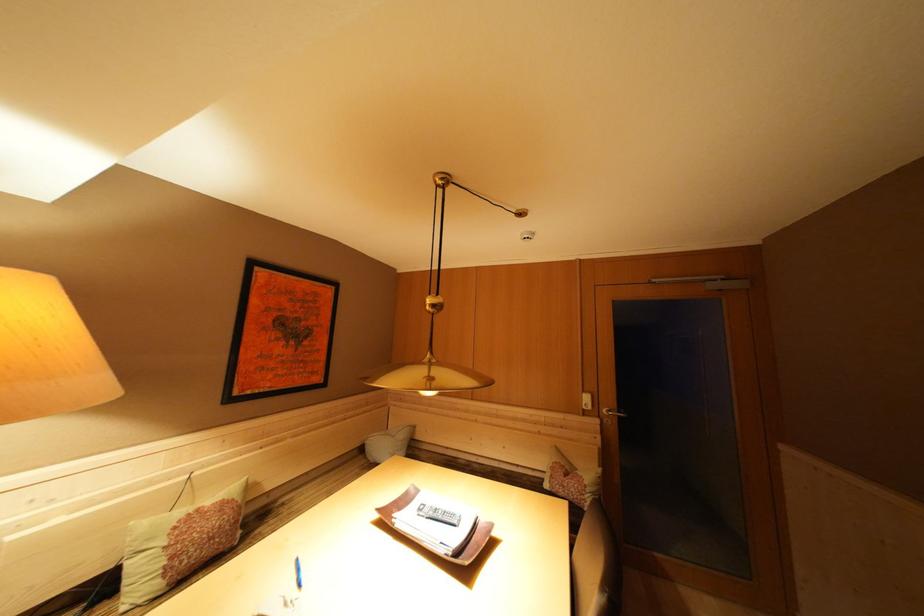
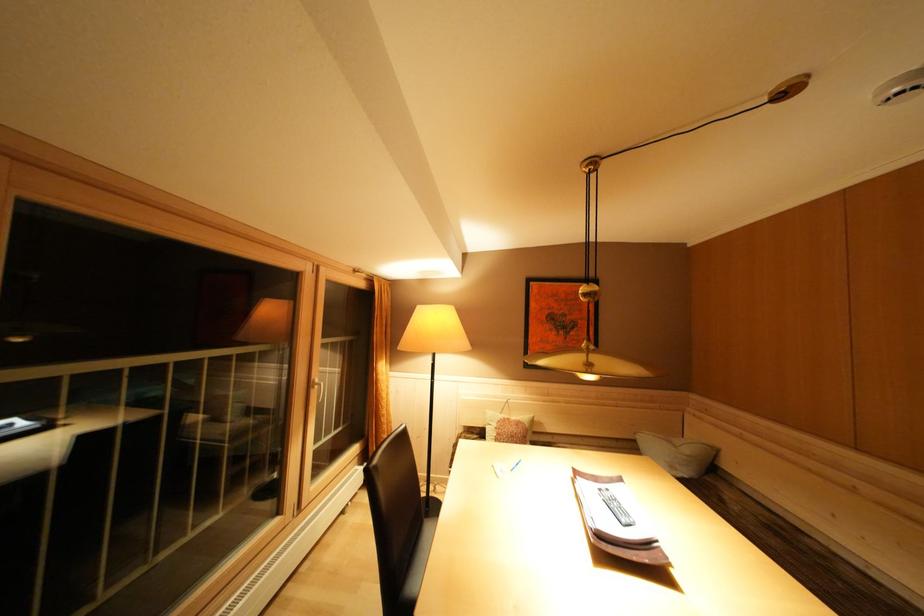
Find the pixel in the second image that matches point 427,515 in the first image.

(608, 495)